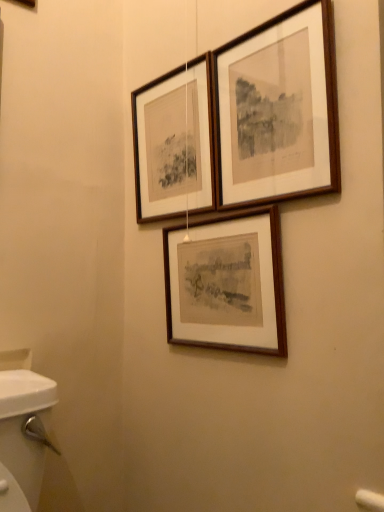
Question: Can wooden frame at center, which is the third picture frame in top-to-bottom order, be found inside wooden picture frame at upper center, the 1th picture frame when ordered from top to bottom?

Choices:
 (A) yes
 (B) no

Answer: (B)

Question: From the image's perspective, is wooden picture frame at upper center, the 1th picture frame when ordered from top to bottom, beneath wooden frame at center, positioned as the first picture frame in bottom-to-top order?

Choices:
 (A) yes
 (B) no

Answer: (B)

Question: Does wooden picture frame at upper center, which is the 3th picture frame in bottom-to-top order, have a lesser width compared to wooden frame at center, positioned as the first picture frame in bottom-to-top order?

Choices:
 (A) yes
 (B) no

Answer: (A)

Question: Is wooden picture frame at upper center, the 1th picture frame when ordered from top to bottom, positioned in front of wooden frame at center, positioned as the first picture frame in bottom-to-top order?

Choices:
 (A) no
 (B) yes

Answer: (B)

Question: Does wooden picture frame at upper center, the 1th picture frame when ordered from top to bottom, appear on the left side of wooden frame at center, which is the third picture frame in top-to-bottom order?

Choices:
 (A) yes
 (B) no

Answer: (B)

Question: From the image's perspective, is wooden picture frame at upper center, the 1th picture frame when ordered from top to bottom, above wooden frame at center, which is the third picture frame in top-to-bottom order?

Choices:
 (A) no
 (B) yes

Answer: (B)

Question: Is wooden frame at center, positioned as the first picture frame in bottom-to-top order, aimed at wooden picture frame at upper center, the 1th picture frame when ordered from top to bottom?

Choices:
 (A) no
 (B) yes

Answer: (A)

Question: From the image's perspective, is wooden frame at center, which is the third picture frame in top-to-bottom order, below wooden picture frame at upper center, which is the 3th picture frame in bottom-to-top order?

Choices:
 (A) yes
 (B) no

Answer: (A)

Question: Is wooden picture frame at upper center, which is the 3th picture frame in bottom-to-top order, surrounded by wooden frame at center, which is the third picture frame in top-to-bottom order?

Choices:
 (A) no
 (B) yes

Answer: (A)

Question: Can you confirm if wooden frame at center, which is the third picture frame in top-to-bottom order, is bigger than wooden picture frame at upper center, the 1th picture frame when ordered from top to bottom?

Choices:
 (A) no
 (B) yes

Answer: (B)

Question: Is wooden frame at center, positioned as the first picture frame in bottom-to-top order, to the left of wooden picture frame at upper center, which is the 3th picture frame in bottom-to-top order, from the viewer's perspective?

Choices:
 (A) yes
 (B) no

Answer: (A)

Question: Is wooden frame at center, positioned as the first picture frame in bottom-to-top order, in contact with wooden picture frame at upper center, which is the 3th picture frame in bottom-to-top order?

Choices:
 (A) no
 (B) yes

Answer: (A)

Question: Considering the relative positions of wooden frame at center, which is the third picture frame in top-to-bottom order, and wooden frame at upper center, the 2th picture frame ordered from the bottom, in the image provided, is wooden frame at center, which is the third picture frame in top-to-bottom order, to the left of wooden frame at upper center, the 2th picture frame ordered from the bottom, from the viewer's perspective?

Choices:
 (A) no
 (B) yes

Answer: (A)